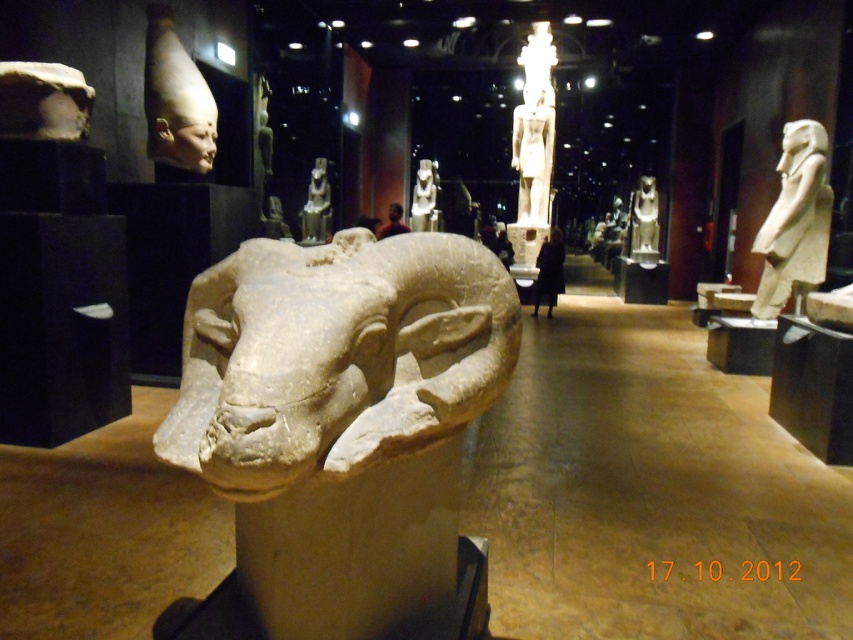
Question: Which is nearer to the white marble statue at right?

Choices:
 (A) gray stone ram at center
 (B) matte beige head at upper left
 (C) polished stone statue at center

Answer: (B)

Question: Where is polished stone statue at center located in relation to matte stone statue at center in the image?

Choices:
 (A) above
 (B) below

Answer: (B)

Question: Considering the relative positions of white marble statue at right and matte stone statue at center in the image provided, where is white marble statue at right located with respect to matte stone statue at center?

Choices:
 (A) right
 (B) left

Answer: (A)

Question: Which point is farther from the camera taking this photo?

Choices:
 (A) (784, 124)
 (B) (416, 173)
 (C) (328, 182)

Answer: (B)

Question: In this image, where is white marble statue at center located relative to matte stone statue at center?

Choices:
 (A) right
 (B) left

Answer: (A)

Question: Which of the following is the closest to the observer?

Choices:
 (A) (421, 186)
 (B) (316, 225)

Answer: (B)